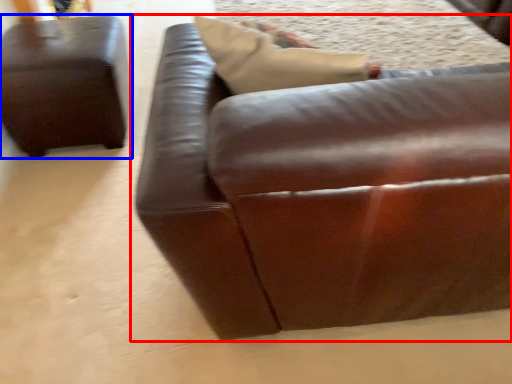
Question: Which of the following is the closest to the observer, studio couch (highlighted by a red box) or studio couch (highlighted by a blue box)?

Choices:
 (A) studio couch
 (B) studio couch

Answer: (A)